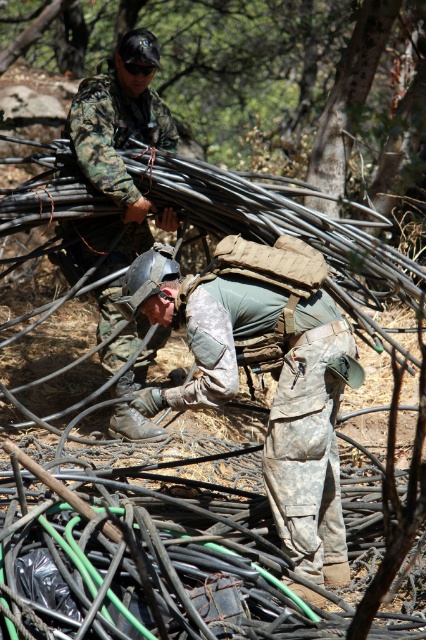
Question: Which point appears closest to the camera in this image?

Choices:
 (A) coord(219,314)
 (B) coord(114,90)

Answer: (A)

Question: Can you confirm if camouflage fabric helmet at center is positioned below camouflage fabric helmet at upper center?

Choices:
 (A) no
 (B) yes

Answer: (B)

Question: Can you confirm if camouflage fabric helmet at center is smaller than camouflage fabric helmet at upper center?

Choices:
 (A) no
 (B) yes

Answer: (B)

Question: Does camouflage fabric helmet at center appear over camouflage fabric helmet at upper center?

Choices:
 (A) yes
 (B) no

Answer: (B)

Question: Which of the following is the farthest from the observer?

Choices:
 (A) camouflage fabric helmet at center
 (B) camouflage fabric helmet at upper center

Answer: (B)

Question: Which of the following is the closest to the observer?

Choices:
 (A) camouflage fabric helmet at upper center
 (B) camouflage fabric helmet at center

Answer: (B)